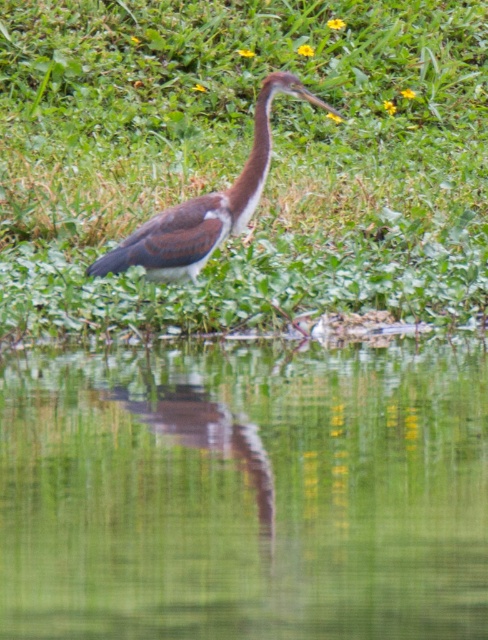
Between brown feathered bird at center and brown matte neck at upper center, which one has less height?

With less height is brown matte neck at upper center.

Is brown feathered bird at center smaller than brown matte neck at upper center?

Incorrect, brown feathered bird at center is not smaller in size than brown matte neck at upper center.

Find the location of a particular element. brown feathered bird at center is located at coordinates (204, 205).

Does green reflective water at center appear on the right side of brown matte neck at upper center?

Incorrect, green reflective water at center is not on the right side of brown matte neck at upper center.

Does green reflective water at center have a lesser width compared to brown matte neck at upper center?

In fact, green reflective water at center might be wider than brown matte neck at upper center.

This screenshot has height=640, width=488. What do you see at coordinates (245, 492) in the screenshot?
I see `green reflective water at center` at bounding box center [245, 492].

The width and height of the screenshot is (488, 640). I want to click on green reflective water at center, so click(245, 492).

Between green leafy grass at center and brown feathered bird at center, which one appears on the left side from the viewer's perspective?

From the viewer's perspective, green leafy grass at center appears more on the left side.

Identify the location of green leafy grass at center. (243, 160).

I want to click on green leafy grass at center, so click(x=243, y=160).